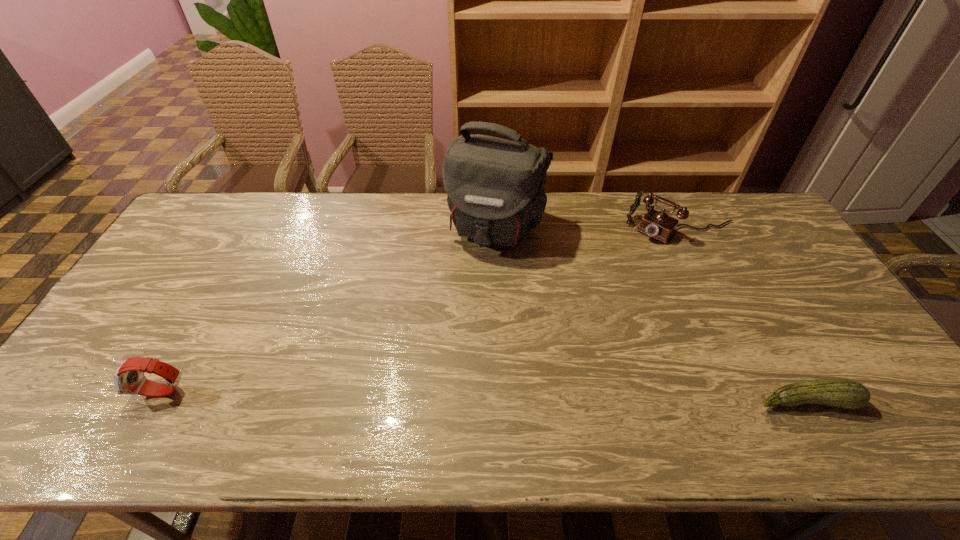
Identify the location of vacant area located on the dial of the telephone. The width and height of the screenshot is (960, 540). (638, 253).

Identify the location of vacant region located 0.180m on the dial of the telephone. (623, 270).

Where is `shoulder bag positioned at the far edge`? Image resolution: width=960 pixels, height=540 pixels. shoulder bag positioned at the far edge is located at coordinates (494, 186).

At what (x,y) coordinates should I click in order to perform the action: click on telephone present at the far edge. Please return your answer as a coordinate pair (x, y). Looking at the image, I should click on (657, 224).

Image resolution: width=960 pixels, height=540 pixels. I want to click on watch positioned at the near edge, so click(129, 378).

The image size is (960, 540). What are the coordinates of `zucchini that is at the near edge` in the screenshot? It's located at (845, 393).

Where is `zucchini positioned at the right edge`? zucchini positioned at the right edge is located at coordinates (845, 393).

In order to click on telephone that is at the right edge in this screenshot , I will do `click(657, 224)`.

The height and width of the screenshot is (540, 960). I want to click on object positioned at the far right corner, so click(657, 224).

Identify the location of object positioned at the near right corner. The image size is (960, 540). (845, 393).